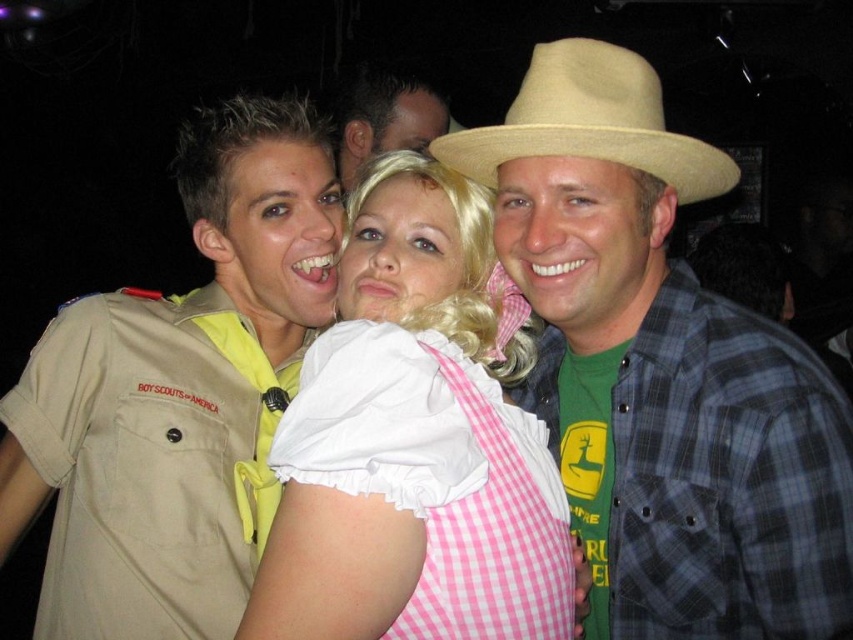
Question: Which is nearer to the beige straw hat at center?

Choices:
 (A) pink gingham dress at center
 (B) matte black shirt at center

Answer: (A)

Question: Is beige straw cowboy hat at center positioned behind matte black shirt at center?

Choices:
 (A) yes
 (B) no

Answer: (B)

Question: Which object is farther from the camera taking this photo?

Choices:
 (A) matte black shirt at center
 (B) pink gingham dress at center

Answer: (A)

Question: Can you confirm if pink gingham dress at center is bigger than beige straw cowboy hat at center?

Choices:
 (A) no
 (B) yes

Answer: (B)

Question: Does beige straw hat at center lie in front of pink gingham dress at center?

Choices:
 (A) yes
 (B) no

Answer: (B)

Question: Among these objects, which one is nearest to the camera?

Choices:
 (A) matte black shirt at center
 (B) beige straw cowboy hat at center
 (C) pink gingham dress at center

Answer: (C)